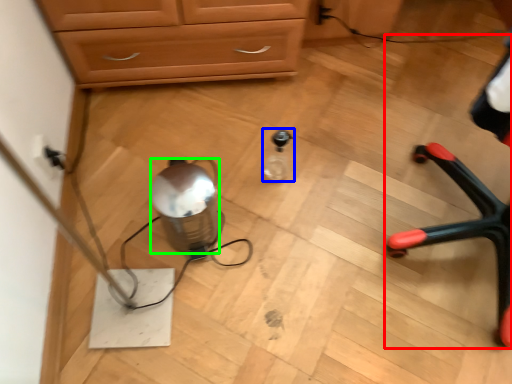
Question: Which is farther away from armchair (highlighted by a red box)? bottle (highlighted by a blue box) or water (highlighted by a green box)?

Choices:
 (A) bottle
 (B) water

Answer: (B)